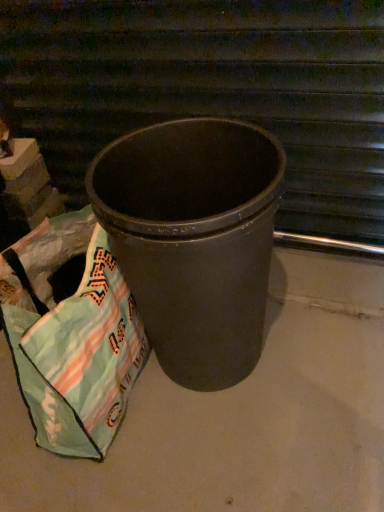
At what (x,y) coordinates should I click in order to perform the action: click on free space in front of matte black trash can at center. Please return your answer as a coordinate pair (x, y). The width and height of the screenshot is (384, 512). Looking at the image, I should click on (240, 453).